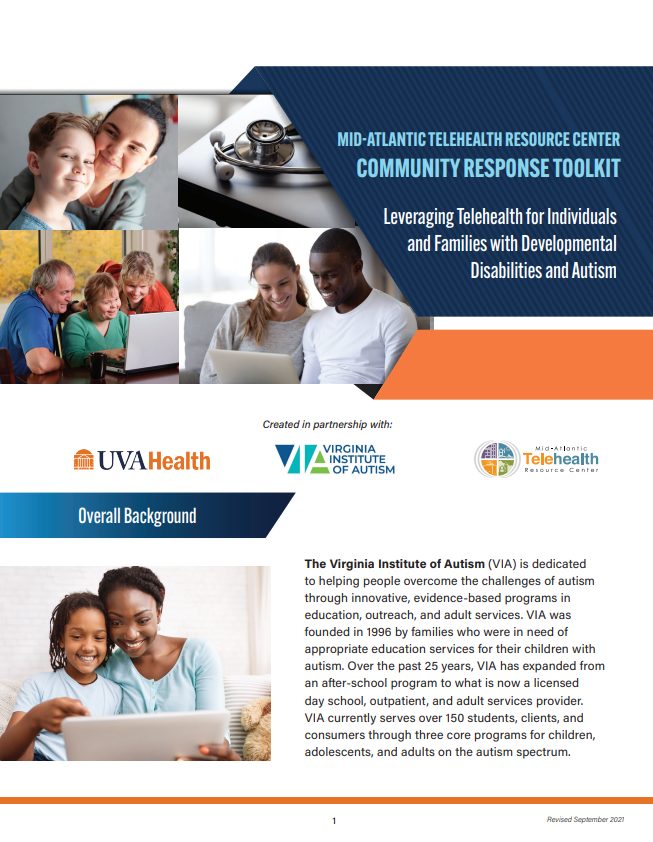
This screenshot has width=653, height=842. Find the location of `white wall`. white wall is located at coordinates (209, 603), (146, 232).